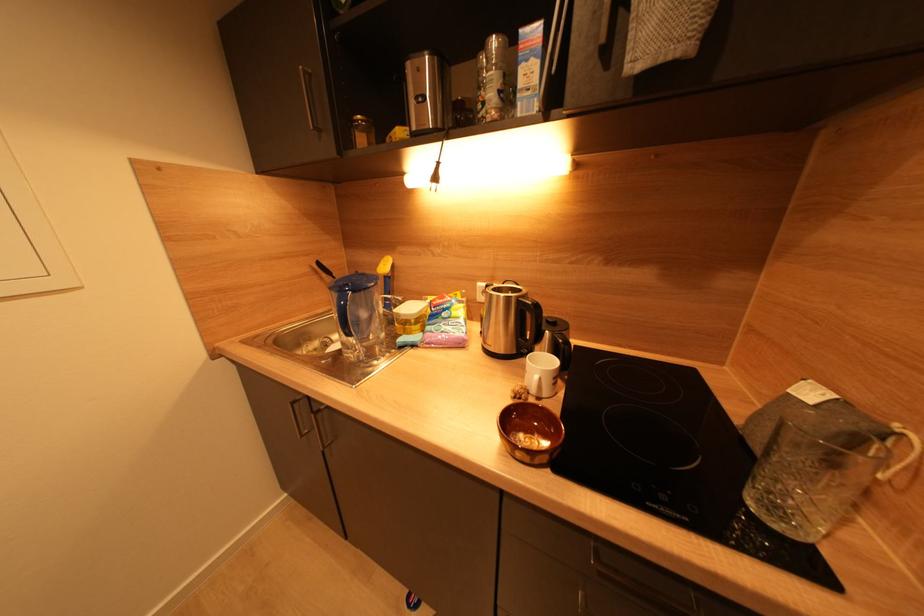
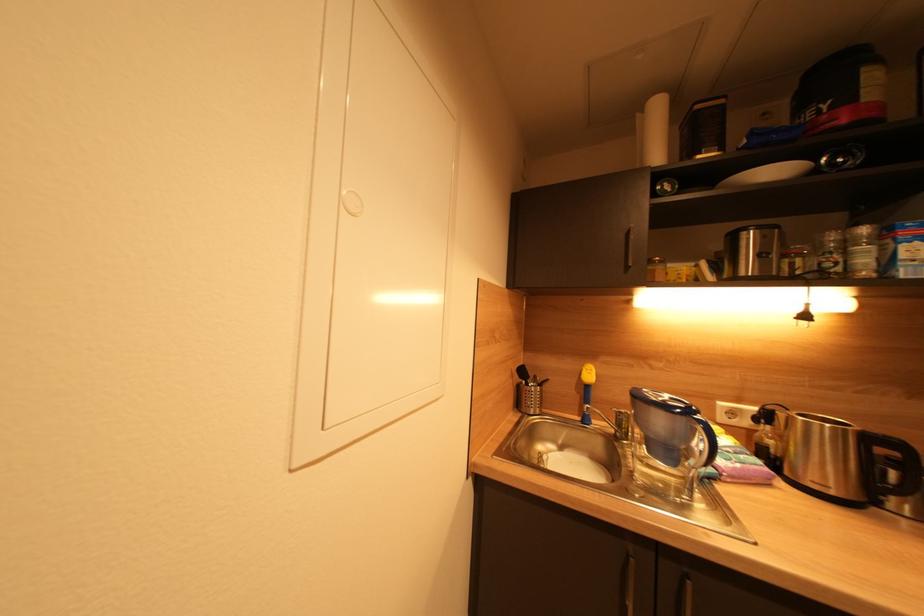
Question: The first image is from the beginning of the video and the second image is from the end. How did the camera likely rotate when shooting the video?

Choices:
 (A) Left
 (B) Right
 (C) Up
 (D) Down

Answer: (C)